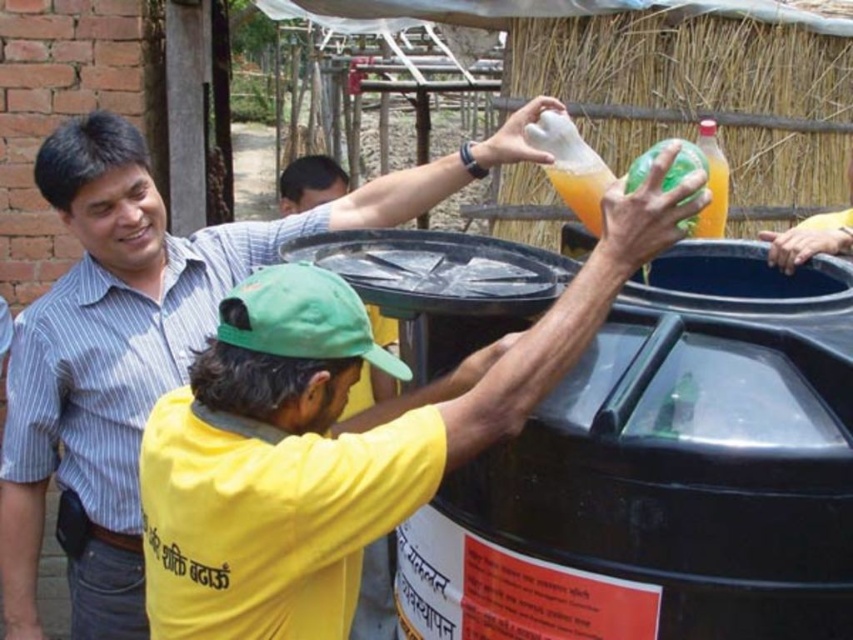
Question: Which point appears closest to the camera in this image?

Choices:
 (A) (718, 157)
 (B) (321, 202)
 (C) (90, 356)

Answer: (C)

Question: Which point appears closest to the camera in this image?

Choices:
 (A) (115, 420)
 (B) (709, 188)
 (C) (363, 624)

Answer: (B)

Question: Is matte black shirt at center below translucent plastic bottle at upper right?

Choices:
 (A) no
 (B) yes

Answer: (B)

Question: Which of the following is the closest to the observer?

Choices:
 (A) (379, 604)
 (B) (514, 116)
 (C) (706, 147)

Answer: (B)

Question: Where is yellow matte shirt at center located in relation to translucent plastic bottle at upper right in the image?

Choices:
 (A) below
 (B) above

Answer: (A)

Question: Does matte black shirt at center come in front of translucent plastic bottle at upper right?

Choices:
 (A) yes
 (B) no

Answer: (B)